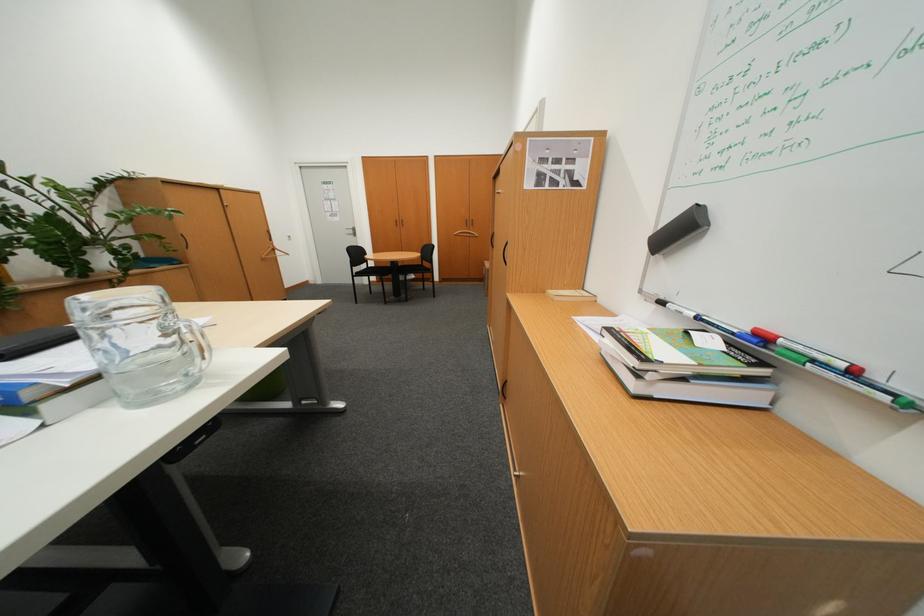
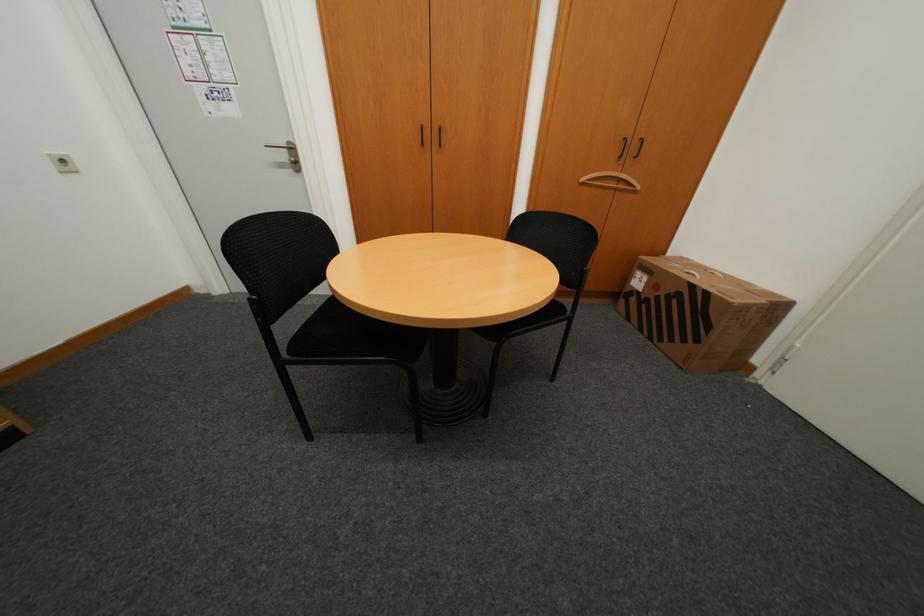
In a continuous first-person perspective shot, in which direction is the camera moving?

The cameraman walked toward left, forward.